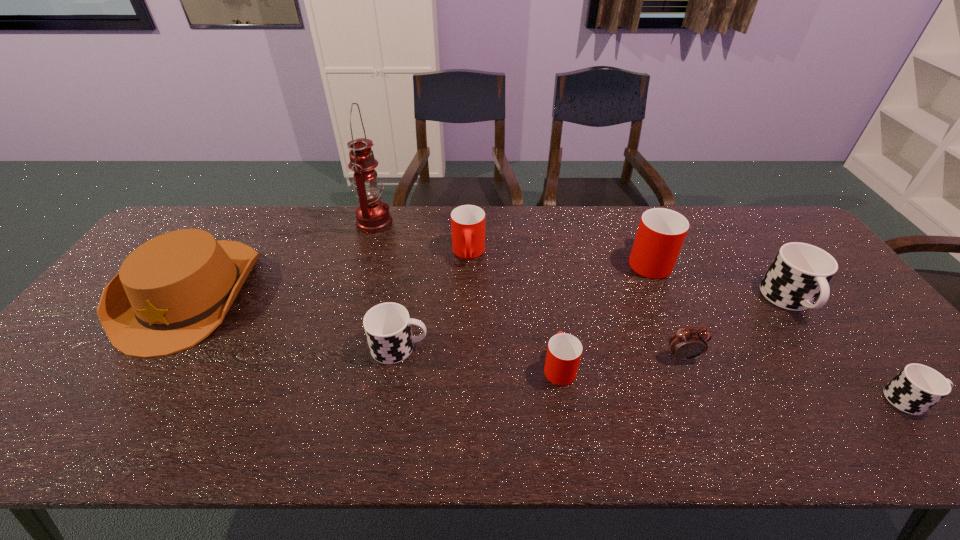
Identify the location of red oil lamp. This screenshot has width=960, height=540. click(x=372, y=214).

This screenshot has height=540, width=960. What are the coordinates of `oil lamp` in the screenshot? It's located at (372, 214).

Locate an element on the screen. This screenshot has width=960, height=540. the tallest cup is located at coordinates (661, 232).

The height and width of the screenshot is (540, 960). I want to click on the eighth shortest object, so click(x=661, y=232).

Locate an element on the screen. the farthest black cup is located at coordinates (800, 272).

This screenshot has height=540, width=960. What are the coordinates of `the leftmost red cup` in the screenshot? It's located at (467, 221).

Identify the location of the second smallest red cup. The image size is (960, 540). (467, 221).

Identify the location of the leftmost object. The width and height of the screenshot is (960, 540). (173, 291).

The image size is (960, 540). Identify the location of cowboy hat. (173, 291).

You are a GUI agent. You are given a task and a screenshot of the screen. Output one action in this format:
    pyautogui.click(x=<x>, y=<y>)
    Task: Click on the alarm clock
    The width and height of the screenshot is (960, 540).
    Given the screenshot: What is the action you would take?
    pyautogui.click(x=686, y=344)